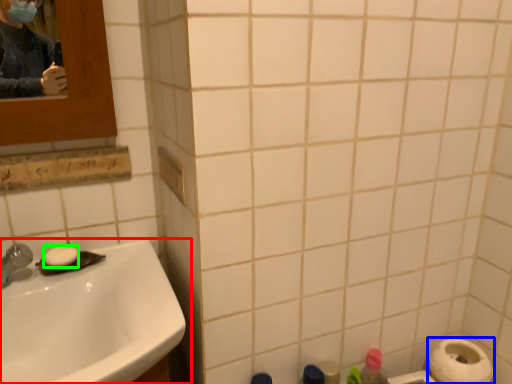
Question: Considering the real-world distances, which object is closest to sink (highlighted by a red box)? toilet paper (highlighted by a blue box) or soap (highlighted by a green box).

Choices:
 (A) toilet paper
 (B) soap

Answer: (B)